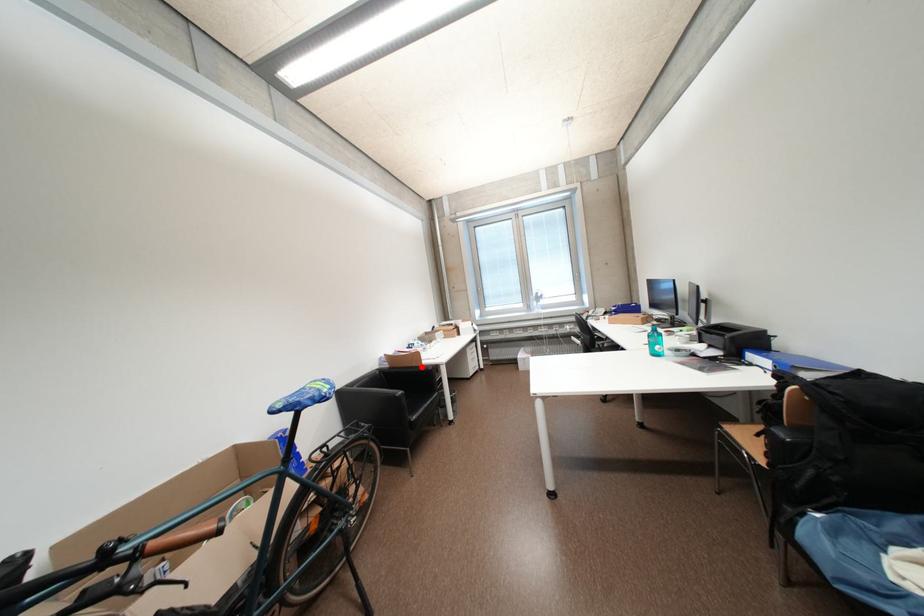
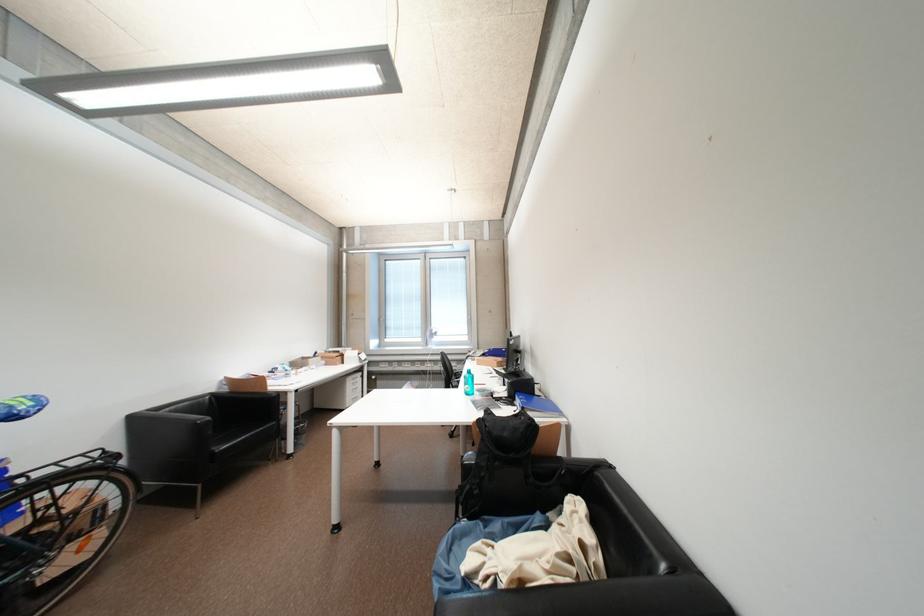
Locate, in the second image, the point that corresponds to the highlighted location in the first image.

(264, 392)